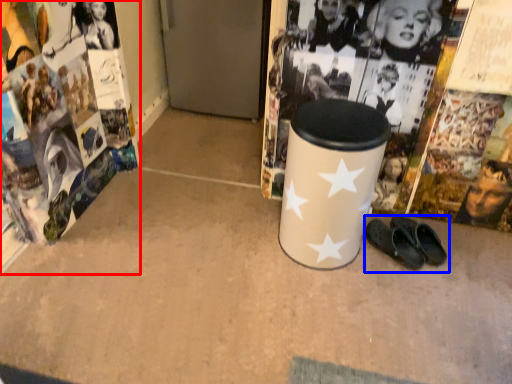
Question: Which object is closer to the camera taking this photo, magazine (highlighted by a red box) or footwear (highlighted by a blue box)?

Choices:
 (A) magazine
 (B) footwear

Answer: (A)